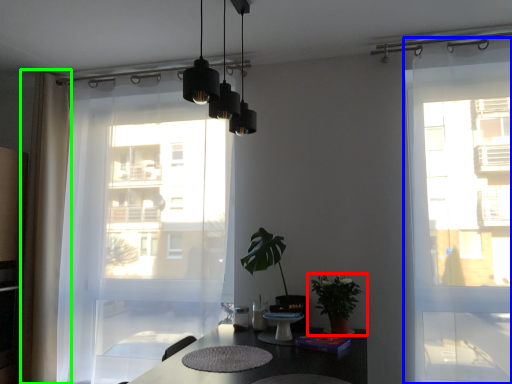
Question: Estimate the real-world distances between objects in this image. Which object is closer to houseplant (highlighted by a red box), door (highlighted by a blue box) or curtain (highlighted by a green box)?

Choices:
 (A) door
 (B) curtain

Answer: (A)